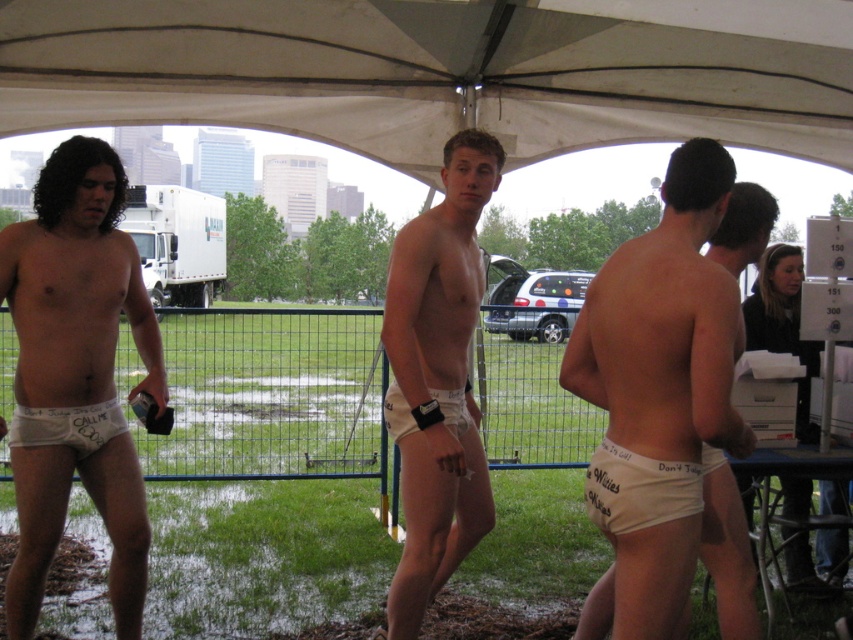
Question: Which of the following is the closest to the observer?

Choices:
 (A) white matte underwear at center
 (B) white cotton underwear at lower right

Answer: (B)

Question: Considering the real-world distances, which object is closest to the white cotton underwear at lower right?

Choices:
 (A) white fabric canopy at upper center
 (B) white cotton underwear at left

Answer: (B)

Question: Does white cotton underwear at center have a greater width compared to white cotton underwear at lower right?

Choices:
 (A) no
 (B) yes

Answer: (A)

Question: Can you confirm if white cotton underwear at center is positioned to the right of white matte underwear at center?

Choices:
 (A) yes
 (B) no

Answer: (A)

Question: Which of the following is the closest to the observer?

Choices:
 (A) white cotton underwear at lower right
 (B) white matte underwear at left

Answer: (A)

Question: Considering the relative positions of white fabric canopy at upper center and white matte underwear at center in the image provided, where is white fabric canopy at upper center located with respect to white matte underwear at center?

Choices:
 (A) above
 (B) below

Answer: (A)